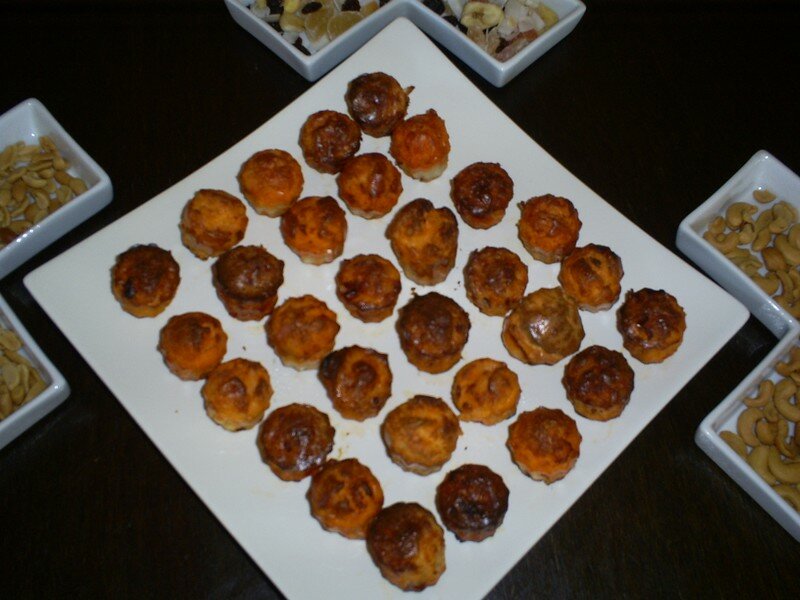
Locate an element on the screen. The height and width of the screenshot is (600, 800). plate is located at coordinates (298, 560).